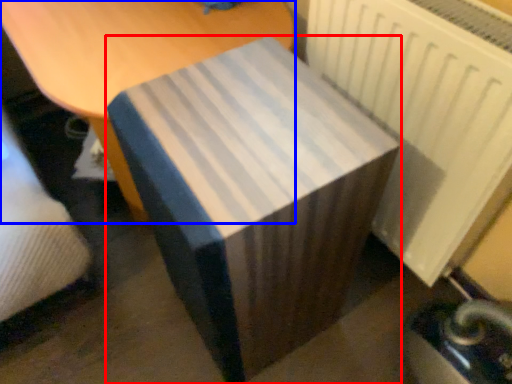
Question: Which object appears closest to the camera in this image, table (highlighted by a red box) or furniture (highlighted by a blue box)?

Choices:
 (A) table
 (B) furniture

Answer: (A)